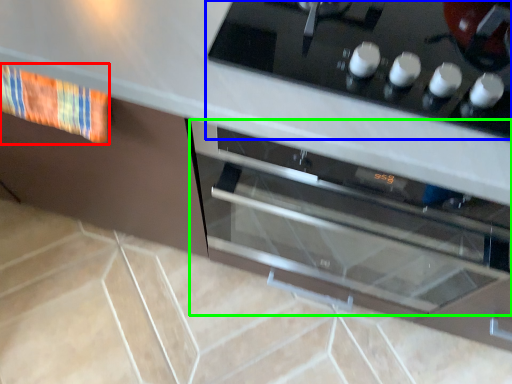
Question: Which is nearer to the material (highlighted by a red box)? home appliance (highlighted by a blue box) or oven (highlighted by a green box).

Choices:
 (A) home appliance
 (B) oven

Answer: (A)